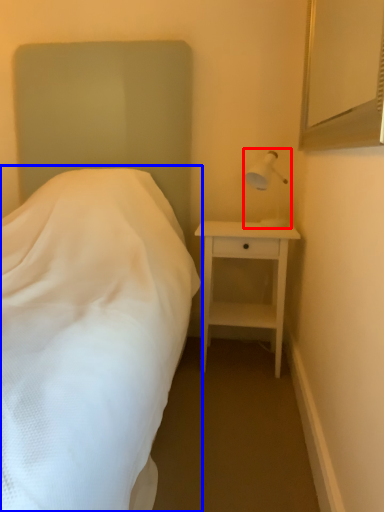
Question: Which point is further to the camera, bedside lamp (highlighted by a red box) or bed (highlighted by a blue box)?

Choices:
 (A) bedside lamp
 (B) bed

Answer: (A)